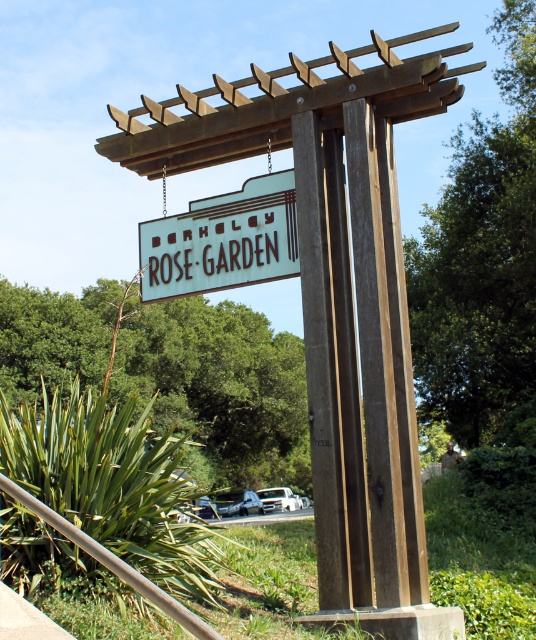
Question: Which point is closer to the camera?

Choices:
 (A) white wood sign at center
 (B) brown wooden pergola at center

Answer: (B)

Question: Does brown wooden pergola at center appear under white wood sign at center?

Choices:
 (A) no
 (B) yes

Answer: (B)

Question: Among these objects, which one is nearest to the camera?

Choices:
 (A) brown wooden pergola at center
 (B) white wood sign at center

Answer: (A)

Question: Which object is farther from the camera taking this photo?

Choices:
 (A) white wood sign at center
 (B) brown wooden pergola at center

Answer: (A)

Question: Can you confirm if brown wooden pergola at center is smaller than white wood sign at center?

Choices:
 (A) no
 (B) yes

Answer: (A)

Question: Can you confirm if brown wooden pergola at center is positioned below white wood sign at center?

Choices:
 (A) no
 (B) yes

Answer: (B)